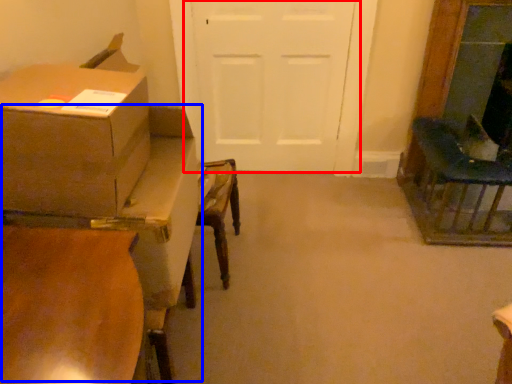
Question: Which object appears closest to the camera in this image, door (highlighted by a red box) or table (highlighted by a blue box)?

Choices:
 (A) door
 (B) table

Answer: (B)